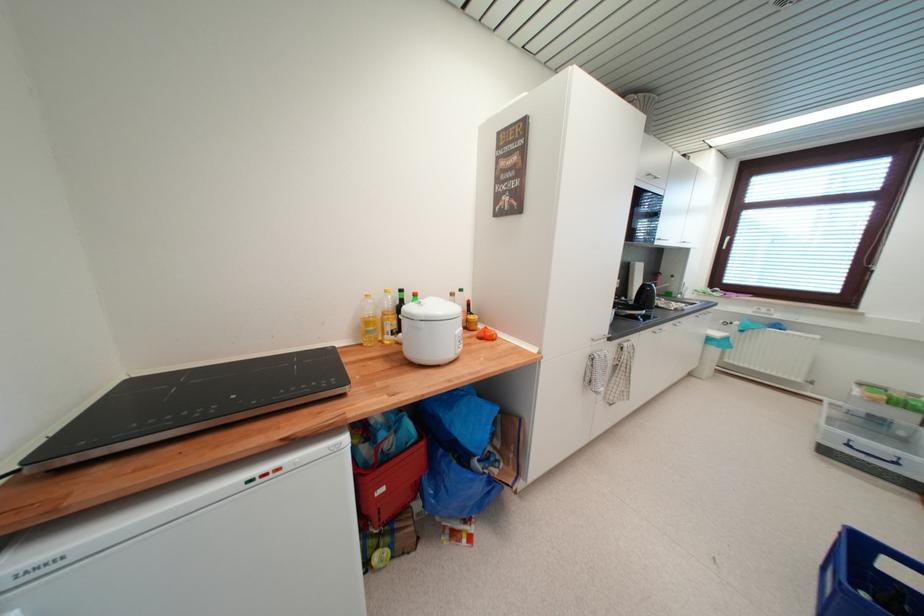
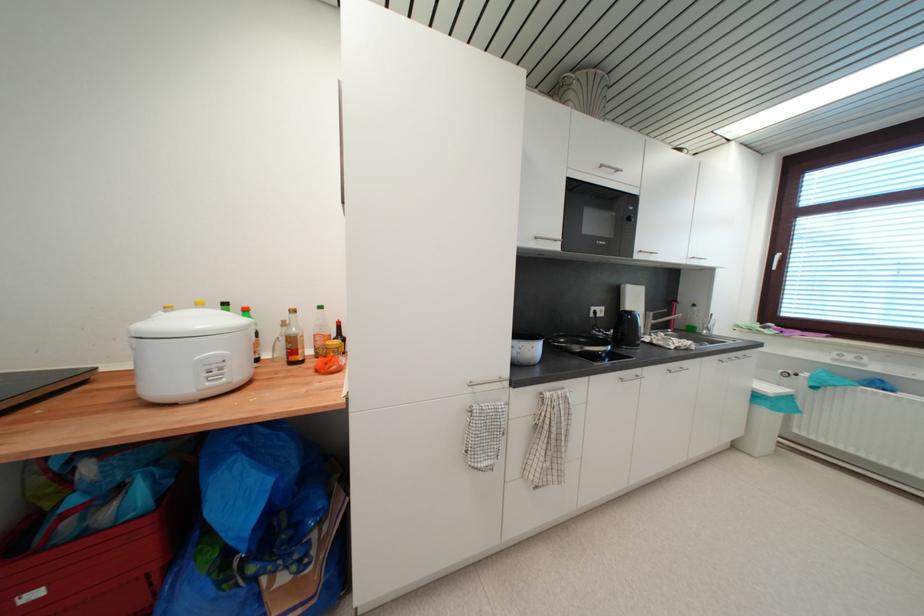
Find the pixel in the second image that matches pixel 733 341 in the first image.

(795, 400)